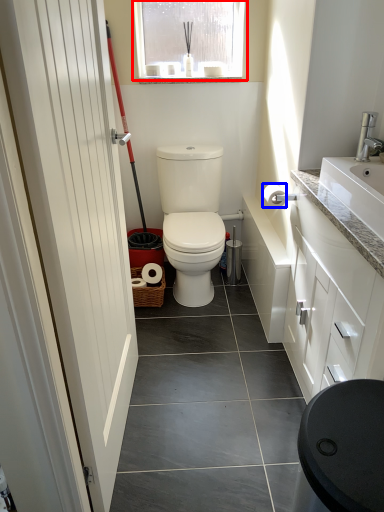
Question: Among these objects, which one is nearest to the camera, window (highlighted by a red box) or toilet paper (highlighted by a blue box)?

Choices:
 (A) window
 (B) toilet paper

Answer: (B)